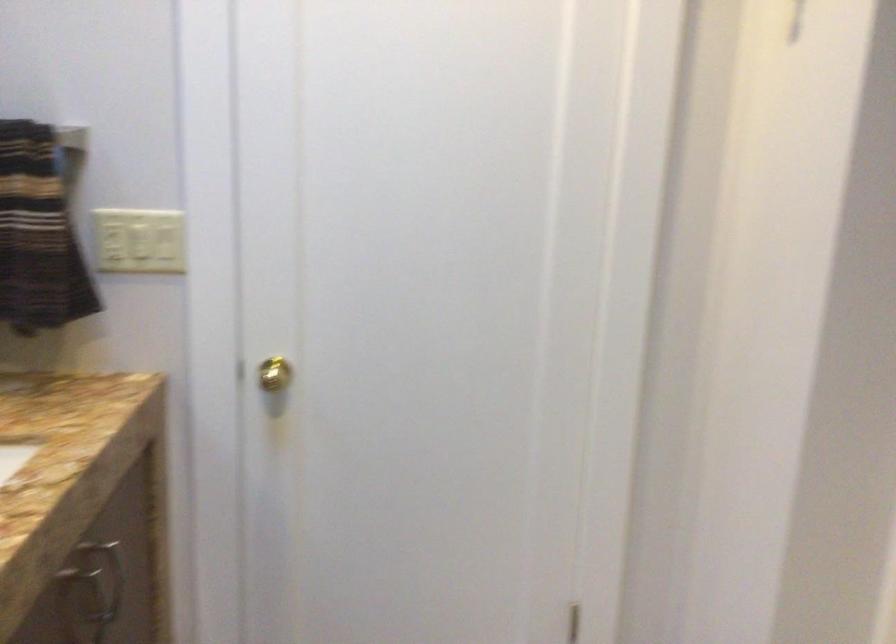
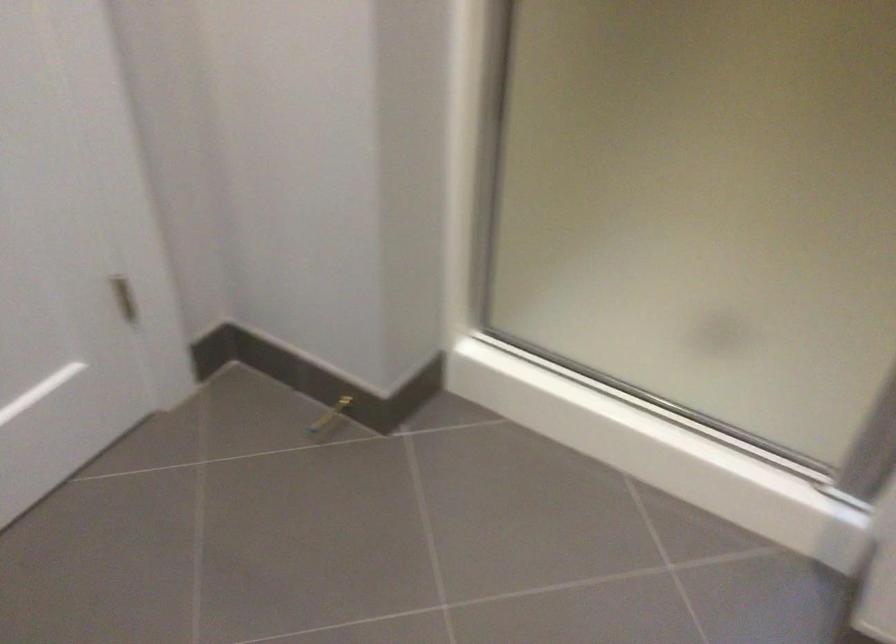
How did the camera likely rotate?

The rotation direction of the camera is right-down.